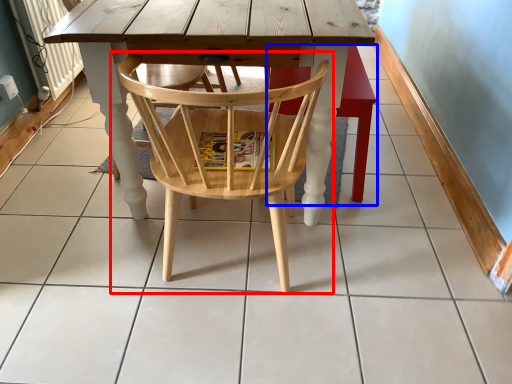
Question: Which of the following is the closest to the observer, chair (highlighted by a red box) or bar stool (highlighted by a blue box)?

Choices:
 (A) chair
 (B) bar stool

Answer: (A)